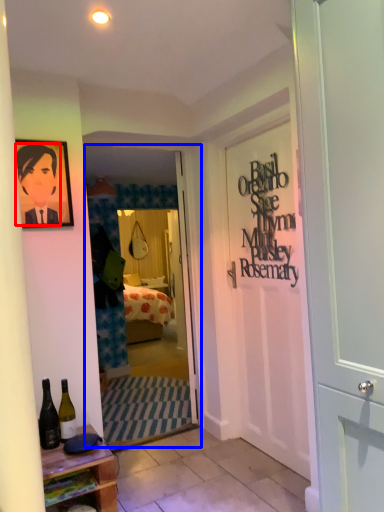
Question: Which point is closer to the camera, person (highlighted by a red box) or screen door (highlighted by a blue box)?

Choices:
 (A) person
 (B) screen door

Answer: (A)